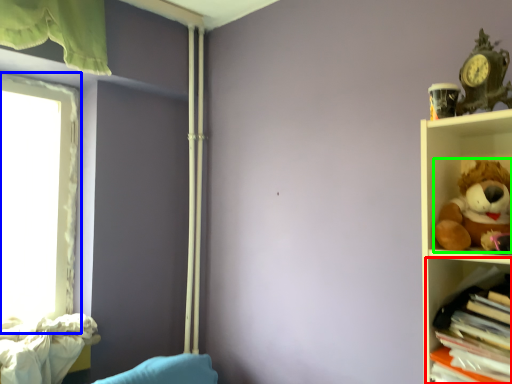
Question: Which is farther away from shelf (highlighted by a red box)? window (highlighted by a blue box) or toy (highlighted by a green box)?

Choices:
 (A) window
 (B) toy

Answer: (A)